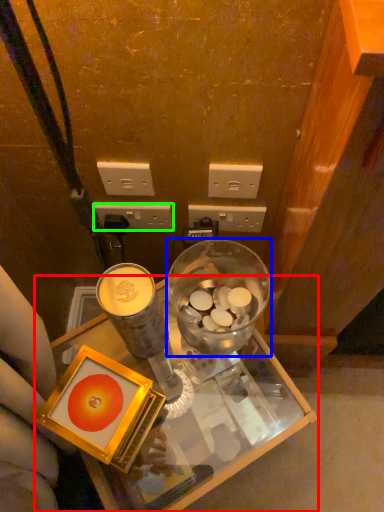
Question: Which object is positioned closest to desk (highlighted by a red box)? Select from tableware (highlighted by a blue box) and power outlet (highlighted by a green box).

Choices:
 (A) tableware
 (B) power outlet

Answer: (A)